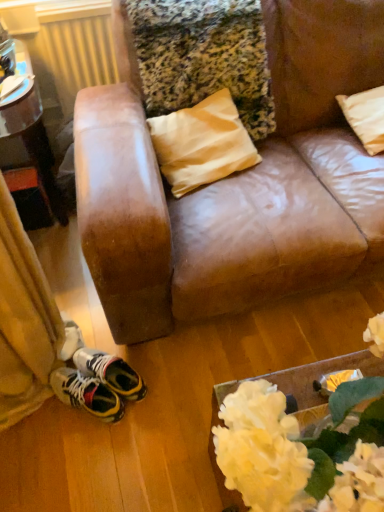
Question: Is point (23, 140) positioned closer to the camera than point (370, 95)?

Choices:
 (A) farther
 (B) closer

Answer: (A)

Question: From the image's perspective, is brushed metal table at left located above or below beige fabric pillow at upper right?

Choices:
 (A) above
 (B) below

Answer: (B)

Question: Estimate the real-world distances between objects in this image. Which object is farther from the metallic yellow radiator at upper left?

Choices:
 (A) beige fabric pillow at upper right
 (B) white fabric flowers at lower right
 (C) brushed metal table at left

Answer: (B)

Question: Which is nearer to the white fabric flowers at lower right?

Choices:
 (A) metallic yellow radiator at upper left
 (B) beige fabric pillow at upper right
 (C) brushed metal table at left

Answer: (B)